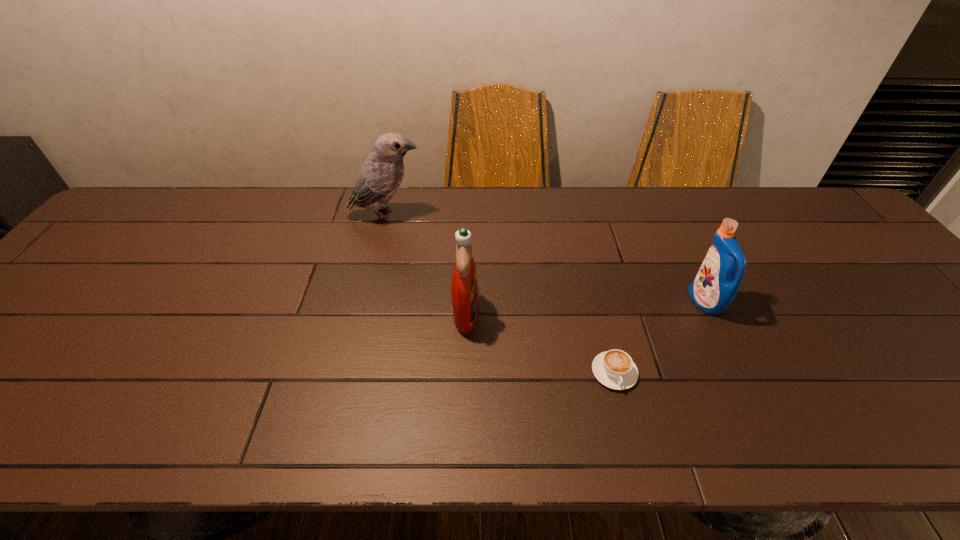
Find the location of `free spot between the shortest object and the parrot`. free spot between the shortest object and the parrot is located at coordinates (500, 294).

Identify the location of free point between the left detergent and the right detergent. The height and width of the screenshot is (540, 960). (586, 307).

The image size is (960, 540). What are the coordinates of `free space between the rightmost object and the parrot` in the screenshot? It's located at (545, 259).

Find the location of `unoccupied area between the farthest object and the rightmost object`. unoccupied area between the farthest object and the rightmost object is located at coordinates (545, 259).

Find the location of a particular element. empty location between the farthest object and the right detergent is located at coordinates (545, 259).

Where is `unoccupied area between the rightmost object and the second object from left to right`? The width and height of the screenshot is (960, 540). unoccupied area between the rightmost object and the second object from left to right is located at coordinates (586, 307).

Identify the location of object that ranks as the third closest to the third object from right to left. (715, 286).

Find the location of a particular element. The height and width of the screenshot is (540, 960). object that can be found as the second closest to the third object from right to left is located at coordinates (379, 178).

Find the location of a particular element. This screenshot has width=960, height=540. vacant space that satisfies the following two spatial constraints: 1. on the label of the rightmost object; 2. on the side of the shortest object with the handle is located at coordinates (739, 372).

Locate an element on the screen. vacant space that satisfies the following two spatial constraints: 1. on the label of the rightmost object; 2. on the side of the nearest object with the handle is located at coordinates (739, 372).